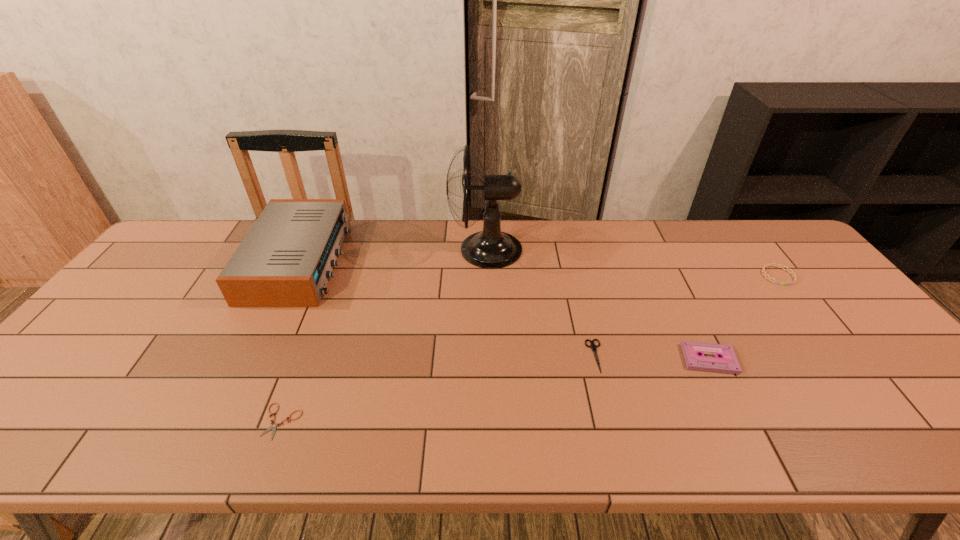
At what (x,y) coordinates should I click in order to perform the action: click on free region that satisfies the following two spatial constraints: 1. on the front-facing side of the taller shears; 2. on the left side of the third object from left to right. Please return your answer as a coordinate pair (x, y). The image size is (960, 540). Looking at the image, I should click on (488, 356).

Find the location of a particular element. This screenshot has height=540, width=960. free region that satisfies the following two spatial constraints: 1. on the front side of the second shortest object; 2. on the right side of the videotape is located at coordinates (596, 359).

Locate an element on the screen. The width and height of the screenshot is (960, 540). vacant region that satisfies the following two spatial constraints: 1. on the front panel of the radio receiver; 2. on the right side of the second shortest object is located at coordinates (253, 356).

The height and width of the screenshot is (540, 960). In order to click on vacant position in the image that satisfies the following two spatial constraints: 1. on the back side of the right shears; 2. on the front panel of the fifth shortest object in this screenshot , I will do `click(572, 261)`.